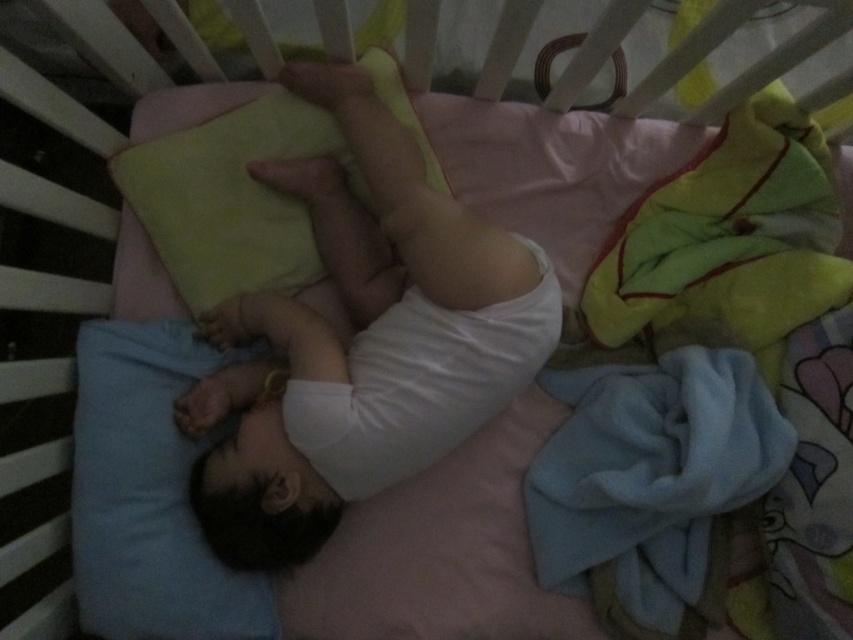
You are a parent checking on your baby in the crib. You see the yellow soft blanket at upper right and the white cloth diaper at center. Which item is positioned higher up in the crib?

The yellow soft blanket at upper right is positioned higher up in the crib than the white cloth diaper at center because it is taller than the diaper.

You are a parent checking on your baby in the crib. You notice the yellow soft blanket at upper right and the white cloth diaper at center. Which item is closer to you when you look at the crib from the front?

The yellow soft blanket at upper right is closer to you because it is in front of the white cloth diaper at center.